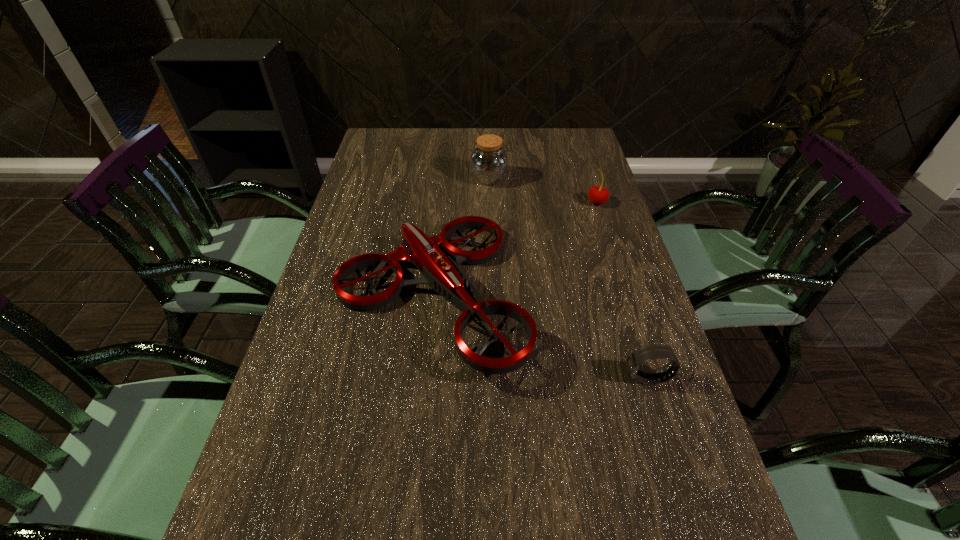
Identify the location of vacant area that lies between the watch and the farthest object. The image size is (960, 540). (568, 278).

What are the coordinates of `vacant area that lies between the watch and the farthest object` in the screenshot? It's located at (568, 278).

Where is `free space between the watch and the drone`? Image resolution: width=960 pixels, height=540 pixels. free space between the watch and the drone is located at coordinates (539, 336).

In order to click on the closest object relative to the farthest object in this screenshot , I will do `click(440, 271)`.

You are a GUI agent. You are given a task and a screenshot of the screen. Output one action in this format:
    pyautogui.click(x=<x>, y=<y>)
    Task: Click on the object identified as the closest to the cherry
    
    Given the screenshot: What is the action you would take?
    pyautogui.click(x=440, y=271)

Identify the location of vacant space that satisfies the following two spatial constraints: 1. on the back side of the drone; 2. on the left side of the second farthest object. (441, 202).